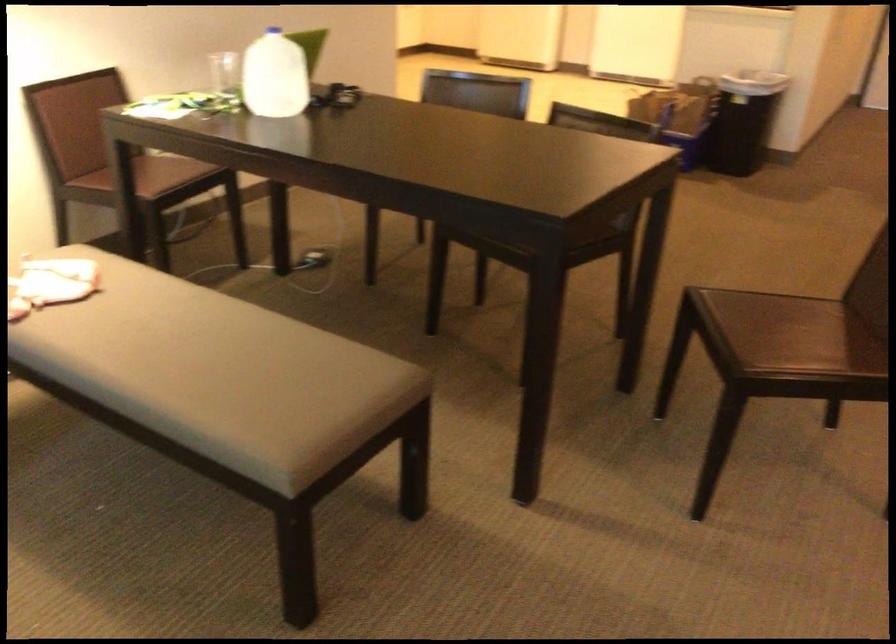
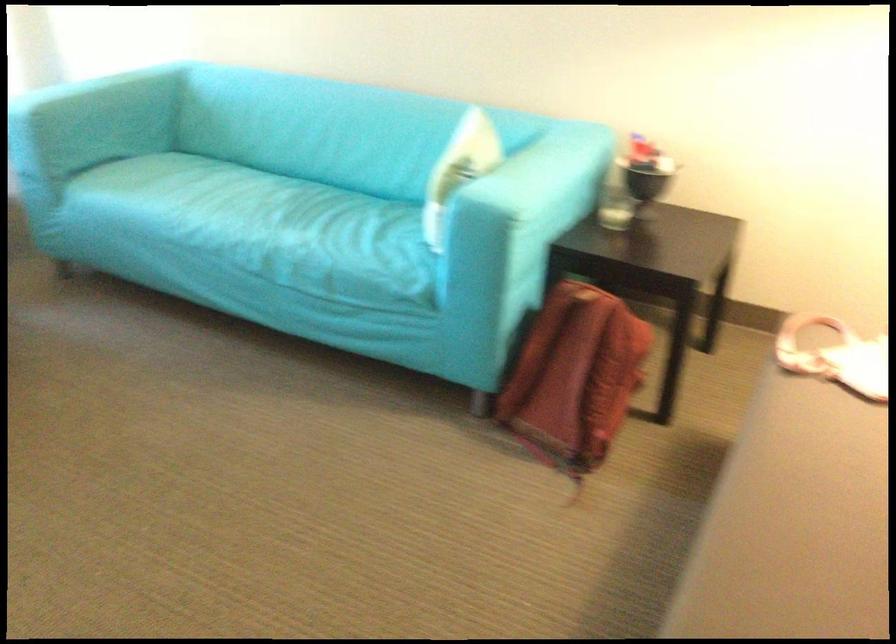
Based on the continuous images, in which direction is the camera rotating?

The camera's rotation is toward left-down.